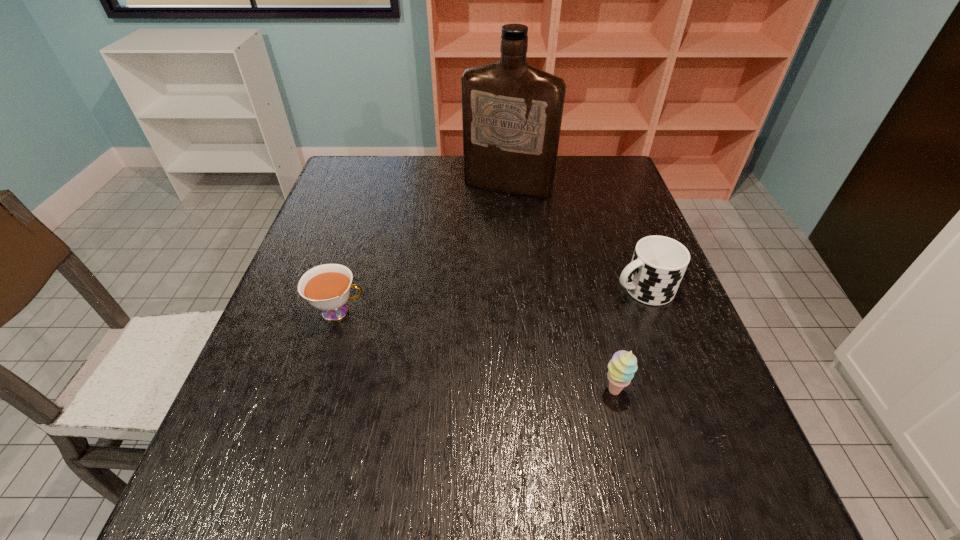
Identify the location of free space located on the side of the rightmost object with the handle. The width and height of the screenshot is (960, 540). (510, 332).

Locate an element on the screen. free spot located on the side of the rightmost object with the handle is located at coordinates (540, 321).

Locate an element on the screen. This screenshot has width=960, height=540. free region located on the label side of the liquor is located at coordinates (480, 226).

What are the coordinates of `vacant space located on the label side of the liquor` in the screenshot? It's located at (468, 249).

Where is `free space located 0.250m on the label side of the liquor`? free space located 0.250m on the label side of the liquor is located at coordinates (468, 252).

I want to click on object situated at the far edge, so click(x=512, y=112).

Locate an element on the screen. object located in the left edge section of the desktop is located at coordinates (326, 287).

The height and width of the screenshot is (540, 960). What are the coordinates of `object that is at the right edge` in the screenshot? It's located at (658, 264).

Where is `vacant space at the far edge of the desktop`? vacant space at the far edge of the desktop is located at coordinates (407, 163).

This screenshot has width=960, height=540. In the image, there is a desktop. Identify the location of free space at the near edge. (379, 412).